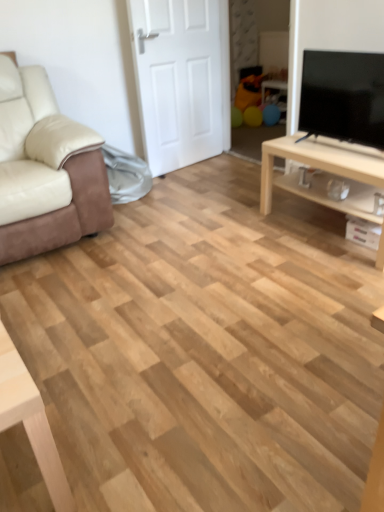
Question: In terms of height, does beige leather couch at left look taller or shorter compared to light wood/texture tv stand at right?

Choices:
 (A) tall
 (B) short

Answer: (A)

Question: From a real-world perspective, relative to light wood/texture tv stand at right, is beige leather couch at left vertically above or below?

Choices:
 (A) below
 (B) above

Answer: (B)

Question: Which is farther from the beige leather couch at left?

Choices:
 (A) white matte door at center
 (B) light wood/texture tv stand at right
 (C) black glossy tv at upper right

Answer: (C)

Question: Which object is positioned farthest from the black glossy tv at upper right?

Choices:
 (A) beige leather couch at left
 (B) light wood/texture tv stand at right
 (C) white matte door at center

Answer: (A)